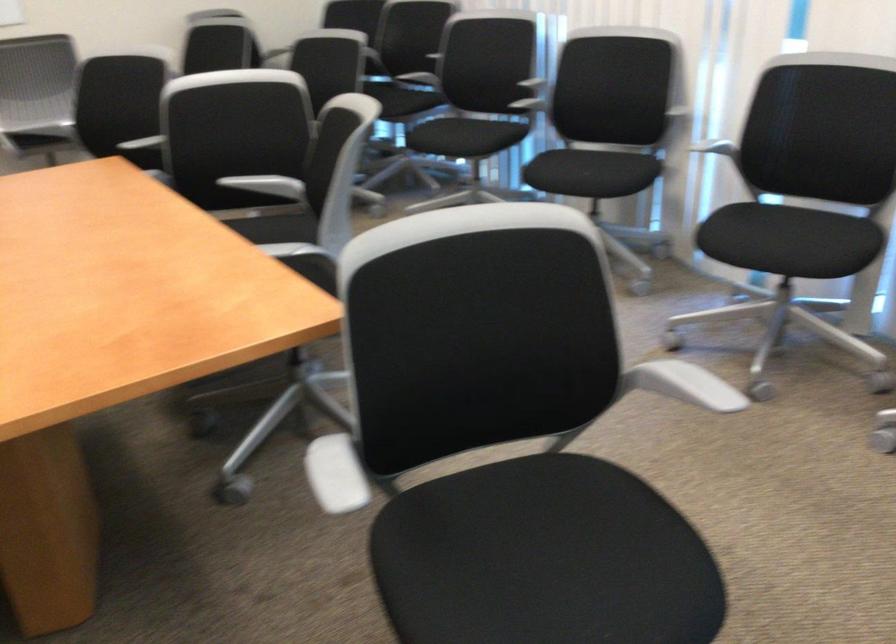
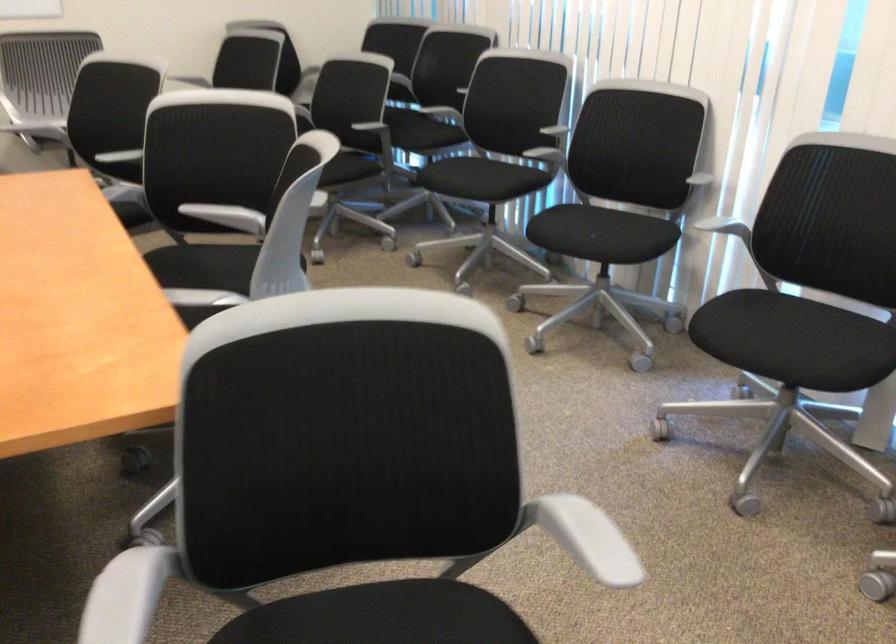
Where in the second image is the point corresponding to point 575,172 from the first image?

(582, 232)